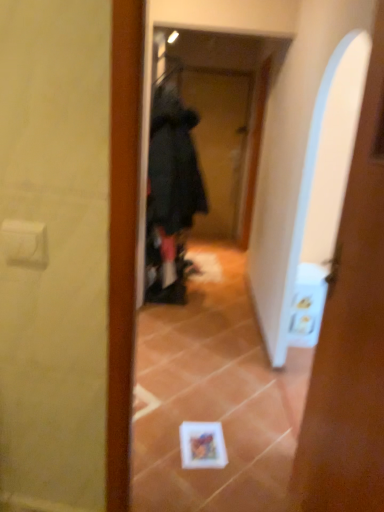
Question: From their relative heights in the image, would you say black fabric screen door at center is taller or shorter than white glossy door at center?

Choices:
 (A) tall
 (B) short

Answer: (A)

Question: From the image's perspective, relative to white glossy door at center, is black fabric screen door at center above or below?

Choices:
 (A) below
 (B) above

Answer: (B)

Question: Which of these objects is positioned closest to the black fabric screen door at center?

Choices:
 (A) white glossy door at center
 (B) black fuzzy bathrobe at center

Answer: (B)

Question: Which of these objects is positioned farthest from the black fuzzy bathrobe at center?

Choices:
 (A) black fabric screen door at center
 (B) white glossy door at center

Answer: (A)